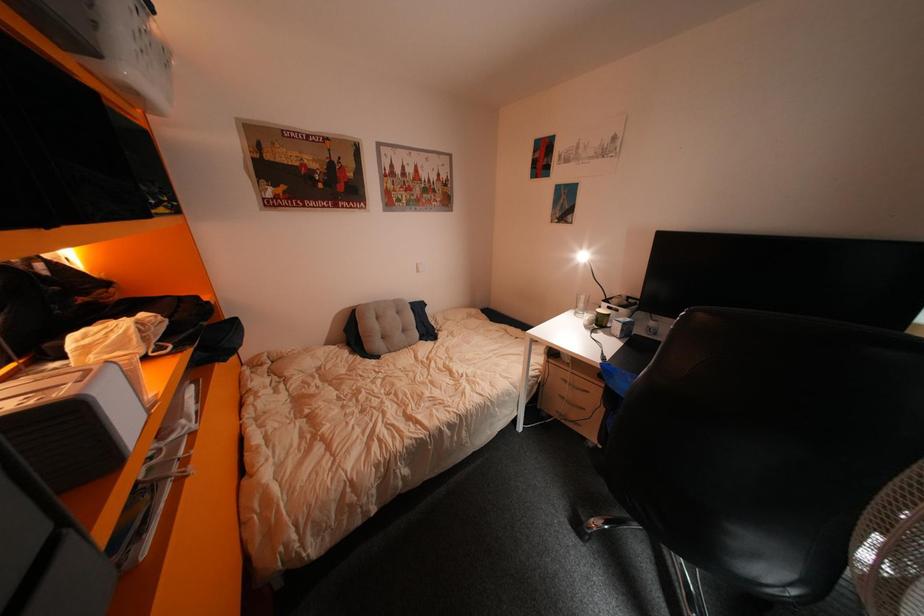
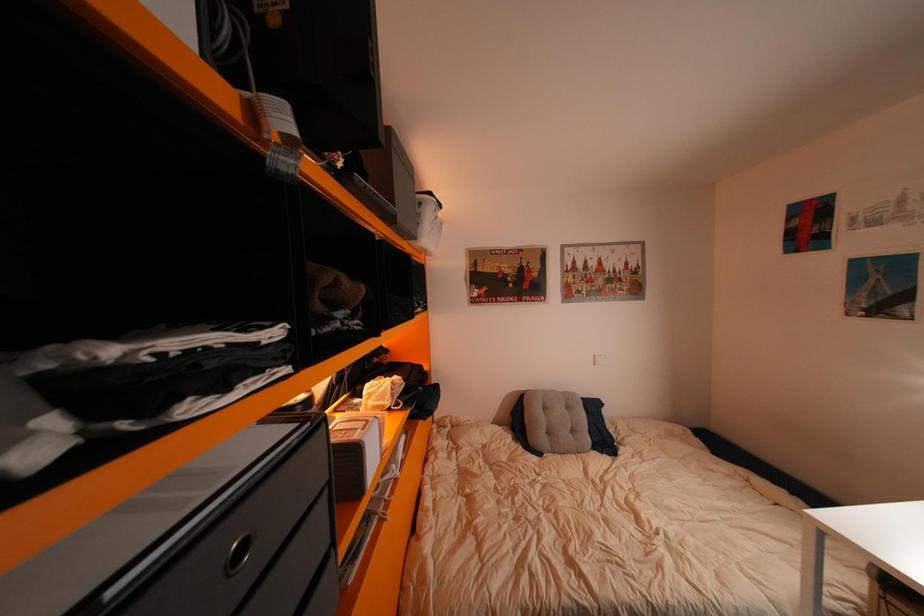
Question: The camera is either moving clockwise (left) or counter-clockwise (right) around the object. The first image is from the beginning of the video and the second image is from the end. Is the camera moving left or right when shooting the video?

Choices:
 (A) Left
 (B) Right

Answer: (B)